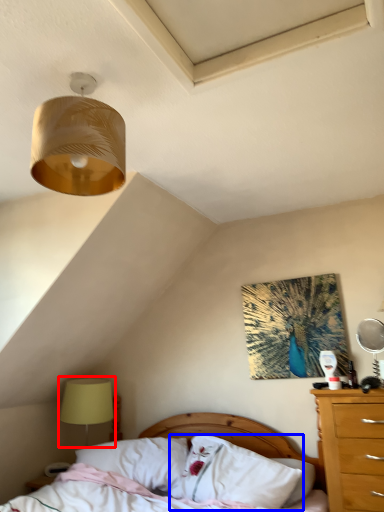
Question: Which point is closer to the camera, table lamp (highlighted by a red box) or pillow (highlighted by a blue box)?

Choices:
 (A) table lamp
 (B) pillow

Answer: (B)